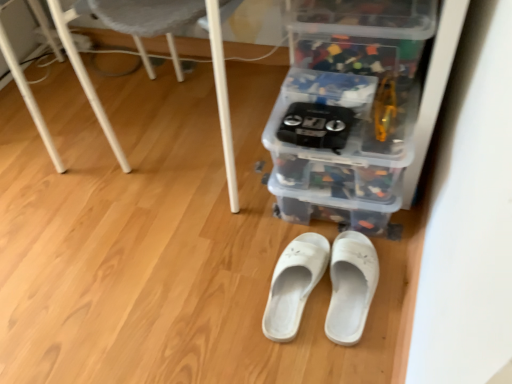
Identify the location of free space to the back side of white fabric slippers at center, placed as the second footwear when sorted from right to left. (252, 226).